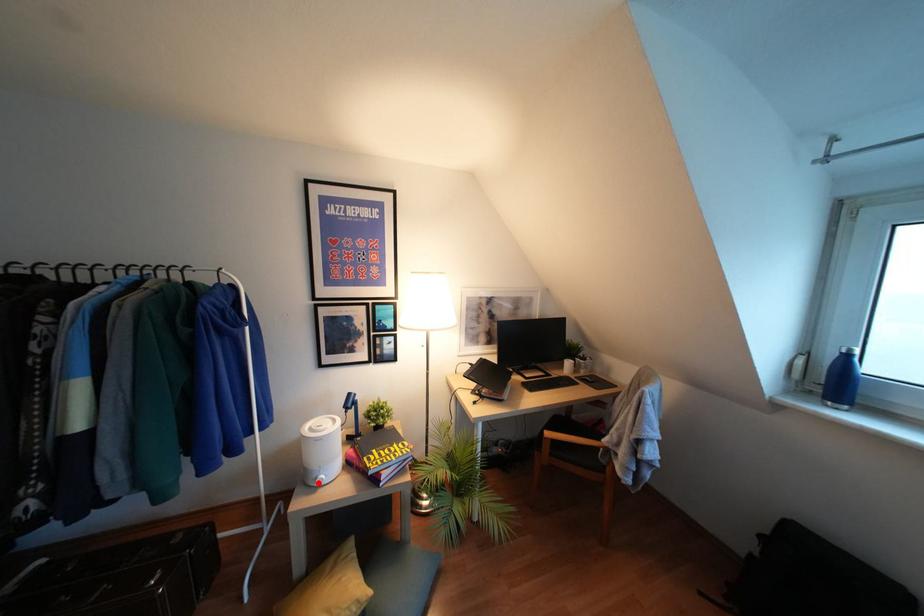
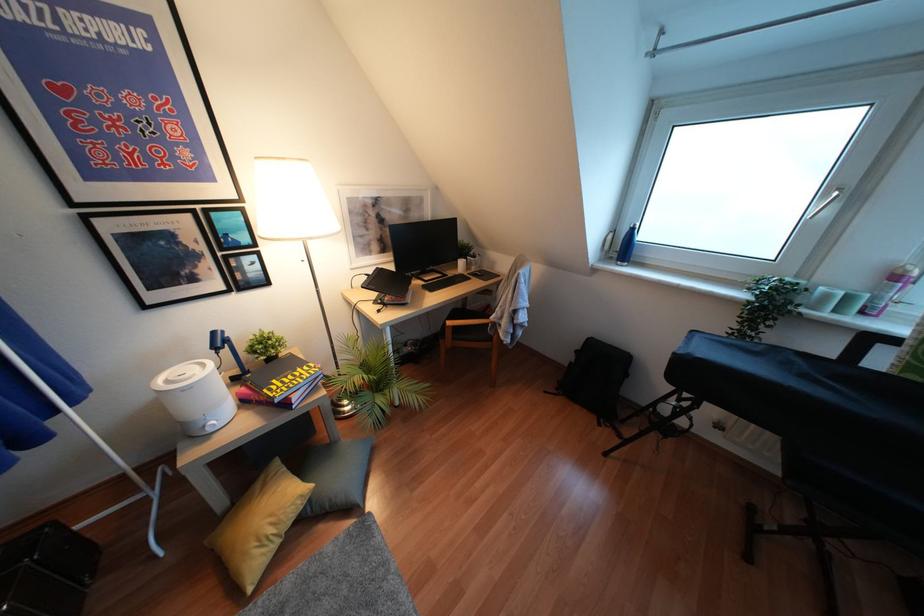
In the second image, find the point that corresponds to the highlighted location in the first image.

(210, 430)